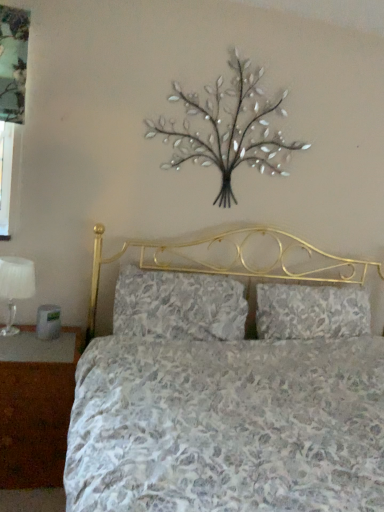
Where is `free space in front of metallic gray alarm clock at left`? Image resolution: width=384 pixels, height=512 pixels. free space in front of metallic gray alarm clock at left is located at coordinates (30, 346).